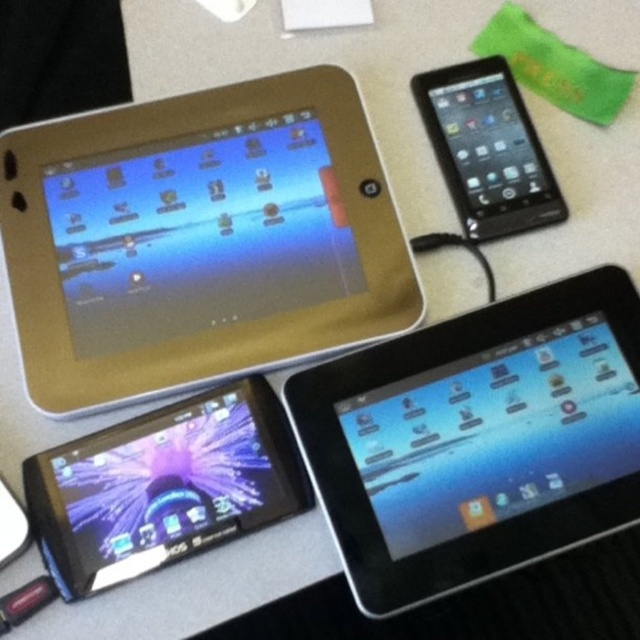
Who is positioned more to the right, black glossy tablet at center or black glossy ipod at upper right?

black glossy ipod at upper right

Locate an element on the screen. black glossy tablet at center is located at coordinates (477, 440).

Locate an element on the screen. The width and height of the screenshot is (640, 640). black glossy tablet at center is located at coordinates (477, 440).

You are a GUI agent. You are given a task and a screenshot of the screen. Output one action in this format:
    pyautogui.click(x=<x>, y=<y>)
    Task: Click on the black glossy tablet at center
    This screenshot has width=640, height=640.
    Given the screenshot: What is the action you would take?
    pyautogui.click(x=477, y=440)

Does black glossy tablet at center have a greater width compared to shiny black tablet at bottom left?

Yes, black glossy tablet at center is wider than shiny black tablet at bottom left.

Which is below, black glossy tablet at center or shiny black tablet at bottom left?

shiny black tablet at bottom left is lower down.

Which is in front, point (492, 456) or point (77, 464)?

Positioned in front is point (77, 464).

Locate an element on the screen. This screenshot has height=640, width=640. black glossy tablet at center is located at coordinates (477, 440).

Between point (204, 164) and point (227, 440), which one is positioned behind?

Positioned behind is point (204, 164).

Does gold matte tablet at upper left appear on the right side of shiny black tablet at bottom left?

Yes, gold matte tablet at upper left is to the right of shiny black tablet at bottom left.

Which is in front, point (387, 259) or point (248, 464)?

Point (248, 464) is more forward.

Locate an element on the screen. The image size is (640, 640). gold matte tablet at upper left is located at coordinates [198, 237].